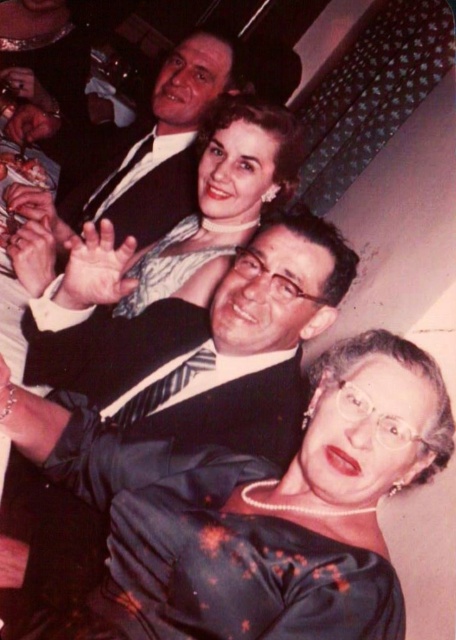
Does point (346, 566) come behind point (149, 250)?

No, (346, 566) is in front of (149, 250).

Can you confirm if silky black dress at center is positioned below sparkly silver dress at center?

Yes.

Locate an element on the screen. The height and width of the screenshot is (640, 456). silky black dress at center is located at coordinates (255, 506).

Locate an element on the screen. silky black dress at center is located at coordinates (255, 506).

Does silky black dress at center have a lesser height compared to matte black suit at upper center?

Correct, silky black dress at center is not as tall as matte black suit at upper center.

Who is more distant from viewer, (x=124, y=612) or (x=190, y=189)?

Point (x=190, y=189)

Where is `silky black dress at center`? This screenshot has width=456, height=640. silky black dress at center is located at coordinates (255, 506).

Between silky black dress at center and shiny black suit at center, which one has more height?

Standing taller between the two is shiny black suit at center.

Who is positioned more to the right, silky black dress at center or shiny black suit at center?

Positioned to the right is silky black dress at center.

Which is behind, point (387, 401) or point (285, 316)?

The point (285, 316) is more distant.

The width and height of the screenshot is (456, 640). I want to click on silky black dress at center, so click(x=255, y=506).